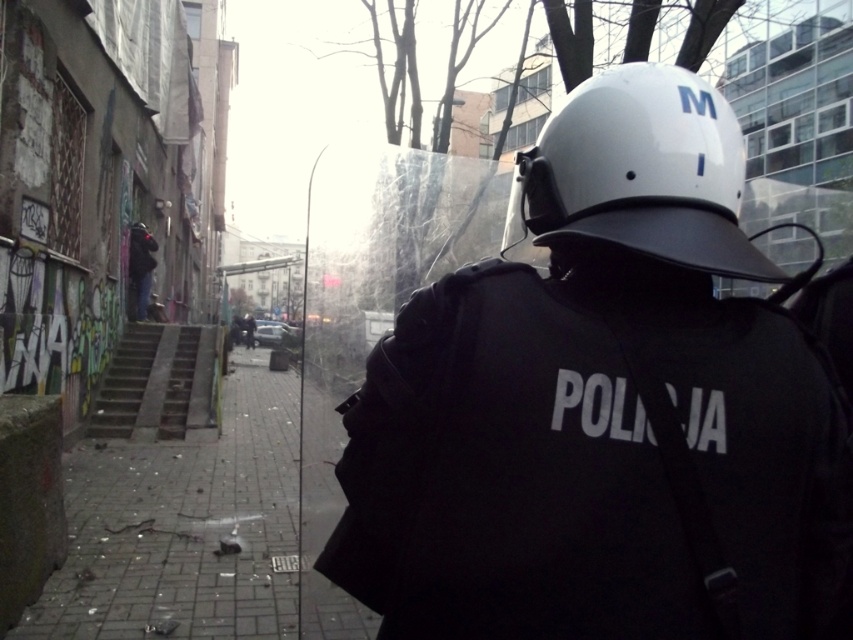
Question: Which object is positioned closest to the white matte helmet at upper center?

Choices:
 (A) concrete stairs at center
 (B) white matte helmet at center

Answer: (B)

Question: Among these points, which one is nearest to the camera?

Choices:
 (A) (114, 420)
 (B) (697, 154)

Answer: (B)

Question: Does white matte helmet at upper center appear under concrete stairs at center?

Choices:
 (A) no
 (B) yes

Answer: (A)

Question: Does white matte helmet at upper center lie in front of concrete stairs at center?

Choices:
 (A) no
 (B) yes

Answer: (B)

Question: Is white matte helmet at center positioned behind concrete stairs at center?

Choices:
 (A) no
 (B) yes

Answer: (A)

Question: Which point is farther to the camera?

Choices:
 (A) concrete stairs at center
 (B) white matte helmet at upper center

Answer: (A)